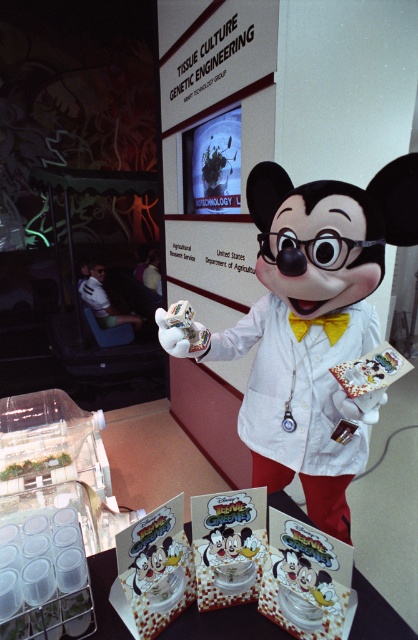
Who is higher up, white glossy mickey mouse at center or white glossy plush at center?

Positioned higher is white glossy plush at center.

Is white glossy mickey mouse at center smaller than white glossy plush at center?

Incorrect, white glossy mickey mouse at center is not smaller in size than white glossy plush at center.

This screenshot has height=640, width=418. I want to click on white glossy mickey mouse at center, so click(x=311, y=320).

You are a GUI agent. You are given a task and a screenshot of the screen. Output one action in this format:
    pyautogui.click(x=<x>, y=<y>)
    Task: Click on the white glossy mickey mouse at center
    
    Given the screenshot: What is the action you would take?
    pyautogui.click(x=311, y=320)